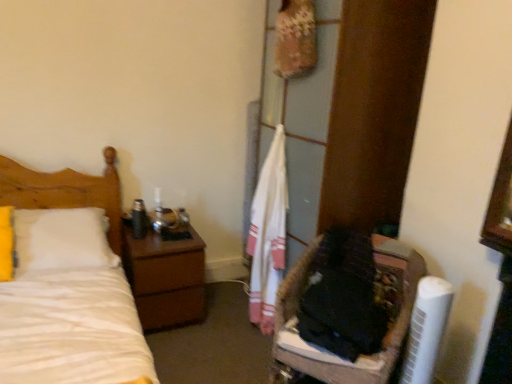
Identify the location of vacant space in front of brown wood nightstand at left. This screenshot has width=512, height=384. (182, 351).